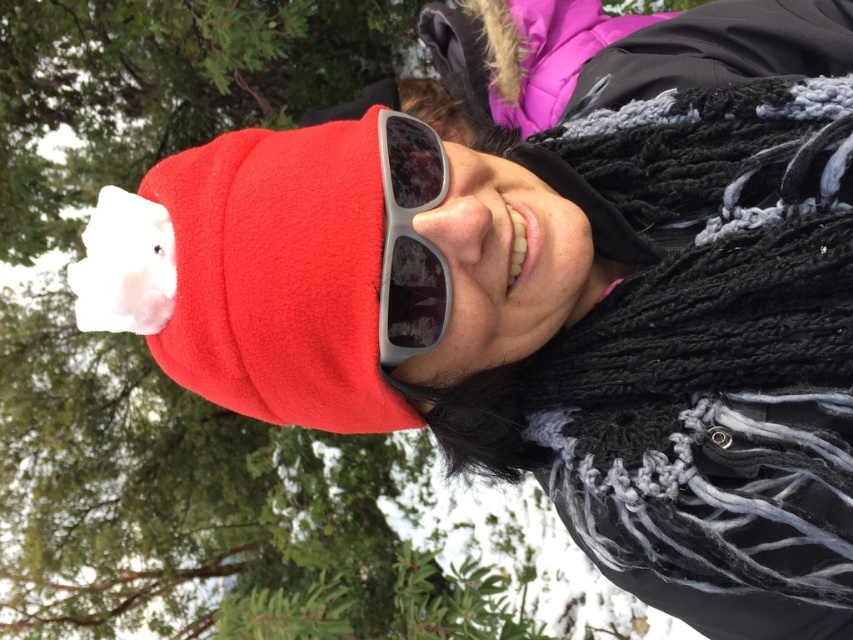
You are a fashion designer trying to create a matching accessory set for the person in the image. You need to decide whether to prioritize the width of the black knitted scarf at right or the gray matte sunglasses at center. Which object has a greater width?

The black knitted scarf at right has a greater width than the gray matte sunglasses at center according to the description.

You are trying to locate your accessories. You remember wearing a black knitted scarf at right and gray matte sunglasses at center. Based on the scene, which of these two items is positioned more to the right?

The black knitted scarf at right is positioned more to the right than the gray matte sunglasses at center.